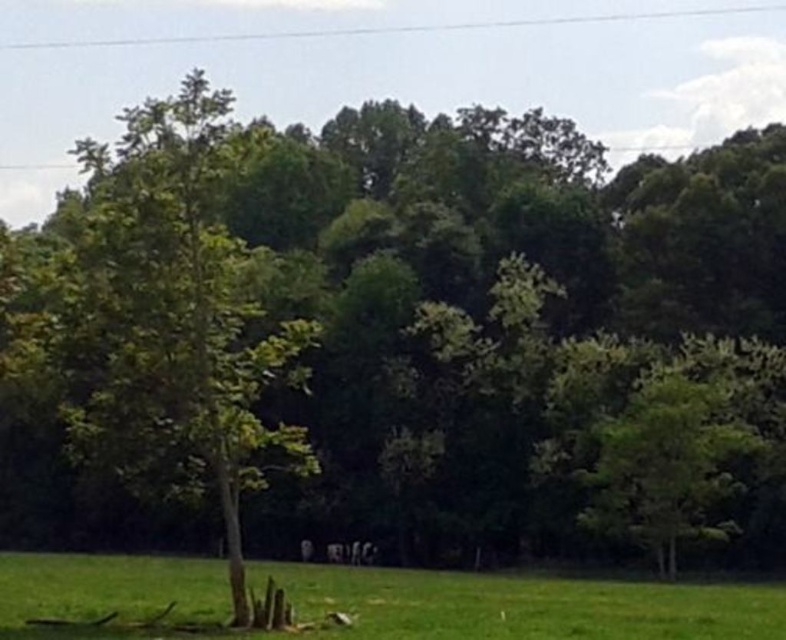
Question: Among these points, which one is farthest from the camera?

Choices:
 (A) (671, 582)
 (B) (129, 364)
 (C) (695, 472)

Answer: (C)

Question: Is green leafy tree at left above green grass at lower center?

Choices:
 (A) yes
 (B) no

Answer: (A)

Question: Can you confirm if green leafy tree at left is smaller than green grass at lower center?

Choices:
 (A) yes
 (B) no

Answer: (B)

Question: Which object is farther from the camera taking this photo?

Choices:
 (A) green grass at lower center
 (B) green leafy tree at right
 (C) green leafy tree at left

Answer: (B)

Question: Estimate the real-world distances between objects in this image. Which object is farther from the green leafy tree at right?

Choices:
 (A) green grass at lower center
 (B) green leafy tree at left

Answer: (B)

Question: Is green leafy tree at left further to camera compared to green leafy tree at right?

Choices:
 (A) yes
 (B) no

Answer: (B)